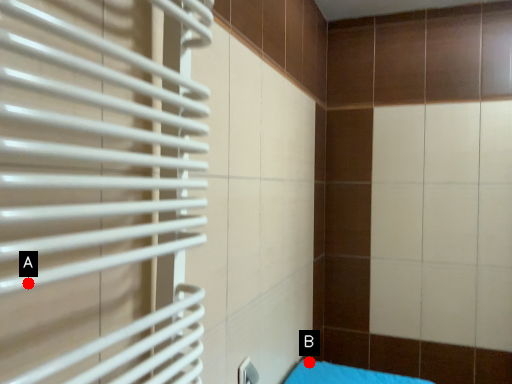
Question: Two points are circled on the image, labeled by A and B beside each circle. Which of the following is the farthest from the observer?

Choices:
 (A) A is further
 (B) B is further

Answer: (B)